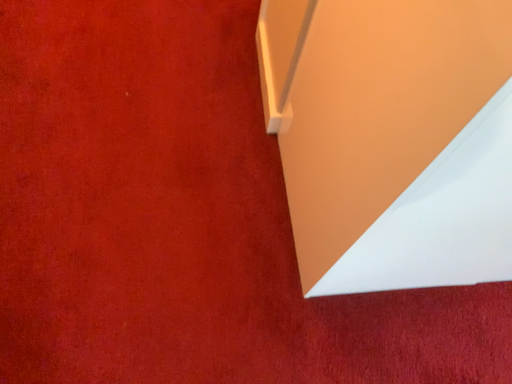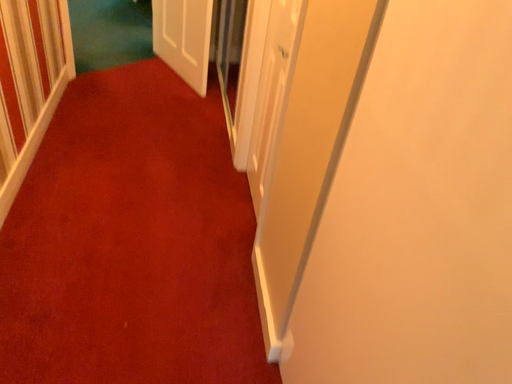
Question: Which way did the camera rotate in the video?

Choices:
 (A) rotated upward
 (B) rotated downward

Answer: (A)